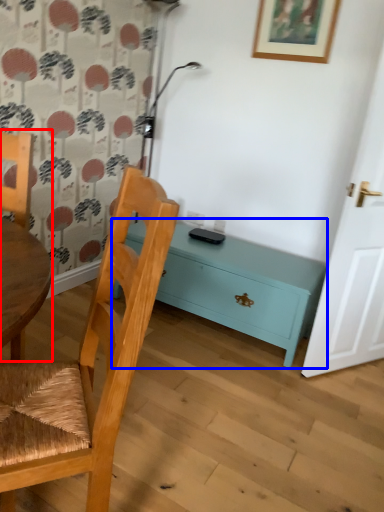
Question: Which object is closer to the camera taking this photo, chair (highlighted by a red box) or nightstand (highlighted by a blue box)?

Choices:
 (A) chair
 (B) nightstand

Answer: (A)